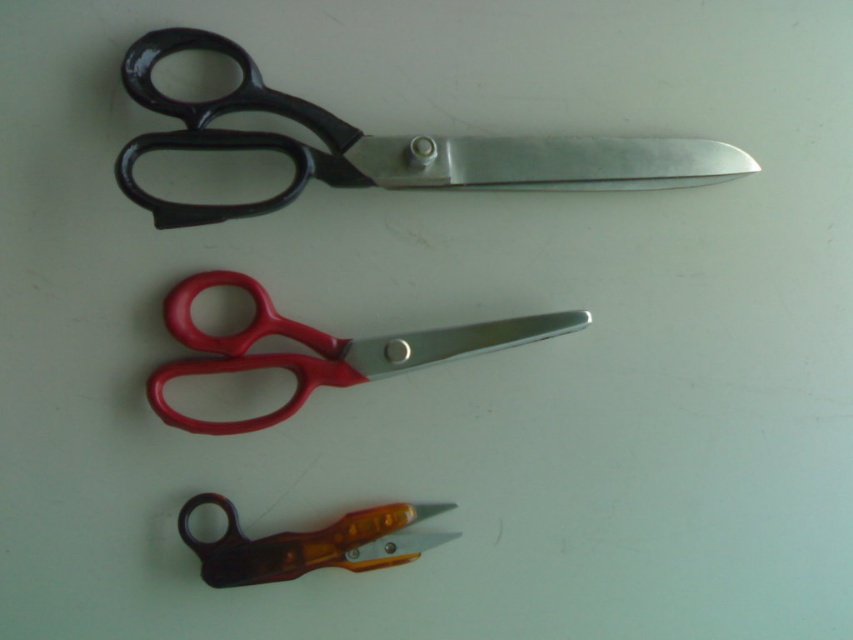
You are an organizer trying to stack the black metallic scissors at upper center and the translucent orange plastic scissors at lower center vertically in a narrow drawer. Based on their sizes, which scissors should you place at the bottom to ensure stability?

The black metallic scissors at upper center is taller than the translucent orange plastic scissors at lower center, so placing the taller black metallic scissors at upper center at the bottom will provide better stability.

You need to choose a pair of scissors to cut a thick cardboard. Based on the image, which pair is more suitable between the black metallic scissors at upper center and the translucent orange plastic scissors at lower center?

The black metallic scissors at upper center is bigger than the translucent orange plastic scissors at lower center, so it is more suitable for cutting thick cardboard as larger scissors typically provide better leverage and strength.

Looking at this image, you are trying to place a ruler between the red plastic scissors at center and the translucent orange plastic scissors at lower center. The ruler is 20 centimeters long. Will it fit between them?

The red plastic scissors at center is 20.90 centimeters away from the translucent orange plastic scissors at lower center. Since the distance between them is 20.90 centimeters, which is slightly longer than the ruler, the ruler can fit between them.